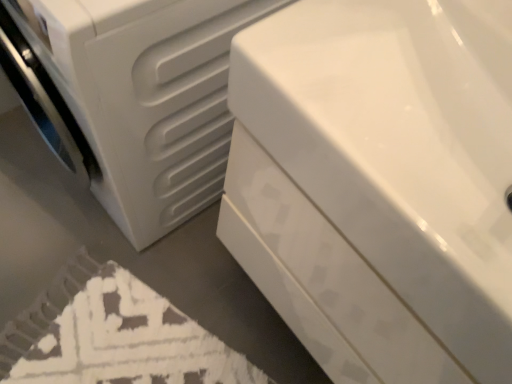
This screenshot has width=512, height=384. I want to click on free point above white textured bath mat at lower left (from a real-world perspective), so click(117, 345).